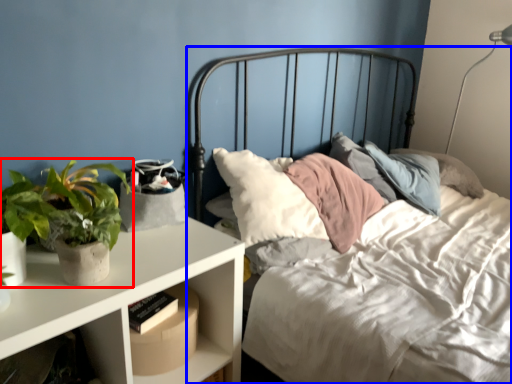
Question: Which object appears closest to the camera in this image, houseplant (highlighted by a red box) or bed (highlighted by a blue box)?

Choices:
 (A) houseplant
 (B) bed

Answer: (B)